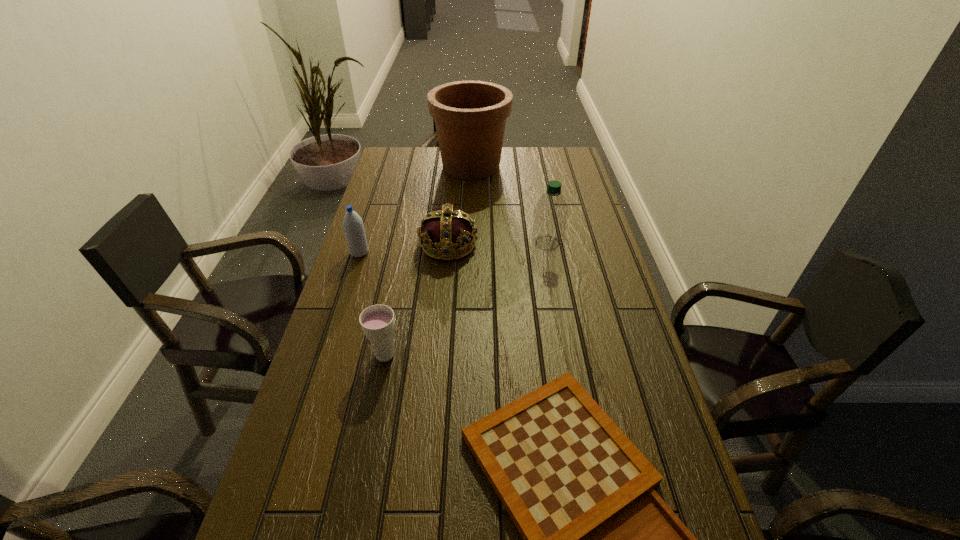
Find the location of a particular element. This screenshot has height=540, width=960. the tallest object is located at coordinates (470, 116).

This screenshot has height=540, width=960. What are the coordinates of `the farthest object` in the screenshot? It's located at [470, 116].

This screenshot has width=960, height=540. What are the coordinates of `the second tallest object` in the screenshot? It's located at (551, 212).

Find the location of a particular element. Image resolution: width=960 pixels, height=540 pixels. the right water bottle is located at coordinates (551, 212).

This screenshot has width=960, height=540. I want to click on the left water bottle, so click(x=353, y=226).

Locate an element on the screen. The height and width of the screenshot is (540, 960). the shorter water bottle is located at coordinates (353, 226).

Where is `crown`? The width and height of the screenshot is (960, 540). crown is located at coordinates (445, 229).

The height and width of the screenshot is (540, 960). Identify the location of the second nearest object. (377, 321).

The image size is (960, 540). In order to click on vacant space located 0.050m on the right of the flowerpot in this screenshot , I will do `click(521, 166)`.

You are a GUI agent. You are given a task and a screenshot of the screen. Output one action in this format:
    pyautogui.click(x=<x>, y=<y>)
    Task: Click on the vacant point located on the left of the right water bottle
    
    Given the screenshot: What is the action you would take?
    pyautogui.click(x=464, y=243)